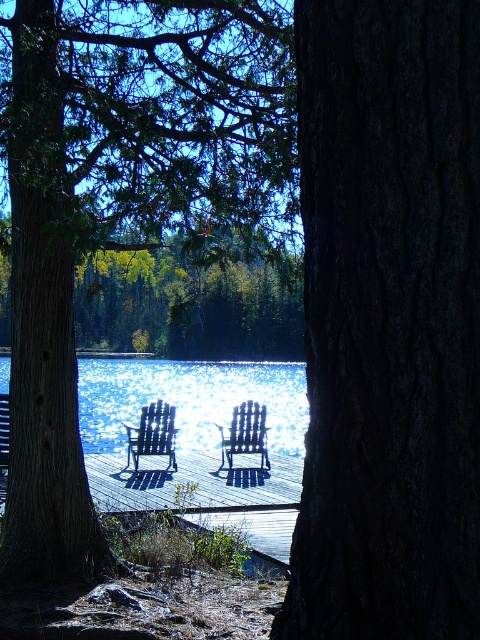
Is point (249, 538) closer to viewer compared to point (172, 456)?

Yes, point (249, 538) is in front of point (172, 456).

Between point (253, 460) and point (135, 458), which one is positioned behind?

Positioned behind is point (253, 460).

Where is `wooden dock at center`? The height and width of the screenshot is (640, 480). wooden dock at center is located at coordinates (206, 492).

Does brown wood tree at center appear on the left side of black wood beach chair at center?

No, brown wood tree at center is not to the left of black wood beach chair at center.

Is brown wood tree at center taller than black wood beach chair at center?

Yes.

Locate an element on the screen. This screenshot has height=640, width=480. brown wood tree at center is located at coordinates (120, 202).

Identify the location of brown wood tree at center. The height and width of the screenshot is (640, 480). (120, 202).

Measure the distance between brown wood tree at center and glistening silver water at center.

35.71 feet

Can you confirm if brown wood tree at center is positioned below glistening silver water at center?

Actually, brown wood tree at center is above glistening silver water at center.

Which is in front, point (231, 8) or point (180, 419)?

Point (231, 8) is more forward.

Locate an element on the screen. brown wood tree at center is located at coordinates (120, 202).